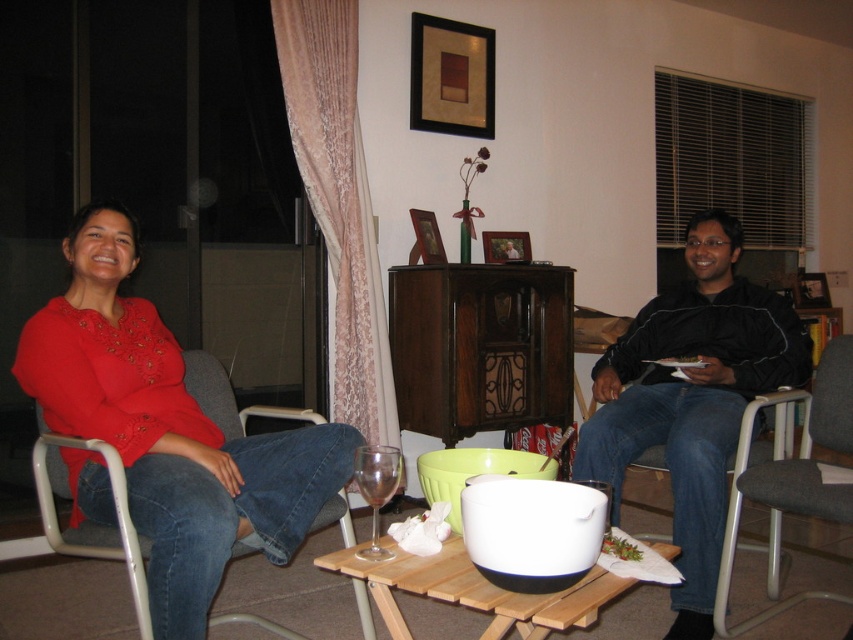
You are planning to place a rectangular box that is 1.2 meters wide on the surface of the wooden tray at center. Considering the size of the metallic gray armchair at right, will the box fit on the tray without overhanging the edges?

The metallic gray armchair at right has a lesser width compared to wooden tray at center. Since the box is 1.2 meters wide, and the tray is wider than the armchair, it should fit as long as the tray can accommodate the box dimensions.

You are planning to place a rectangular book that is 12 inches wide on the coffee table. Given the objects on the table, which object would you need to move to make space, considering the black softshell jacket at right is wider than the transparent glass wine glass at center?

The black softshell jacket at right has a larger width than the transparent glass wine glass at center, so moving the black softshell jacket at right would create more space for the book.